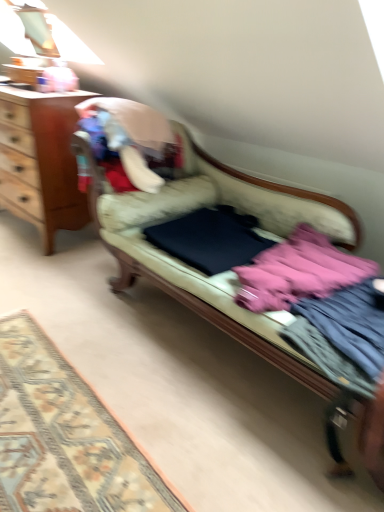
Find the location of a particular element. Image resolution: width=384 pixels, height=512 pixels. free space in front of wooden desk at left is located at coordinates (40, 262).